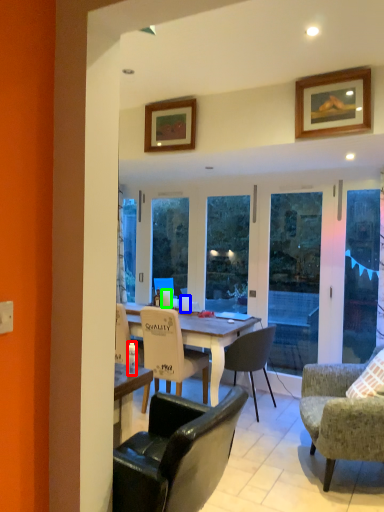
Question: Which object is positioned farthest from bottle (highlighted by a red box)? Select from coffee cup (highlighted by a blue box) and coffee cup (highlighted by a green box).

Choices:
 (A) coffee cup
 (B) coffee cup

Answer: (B)